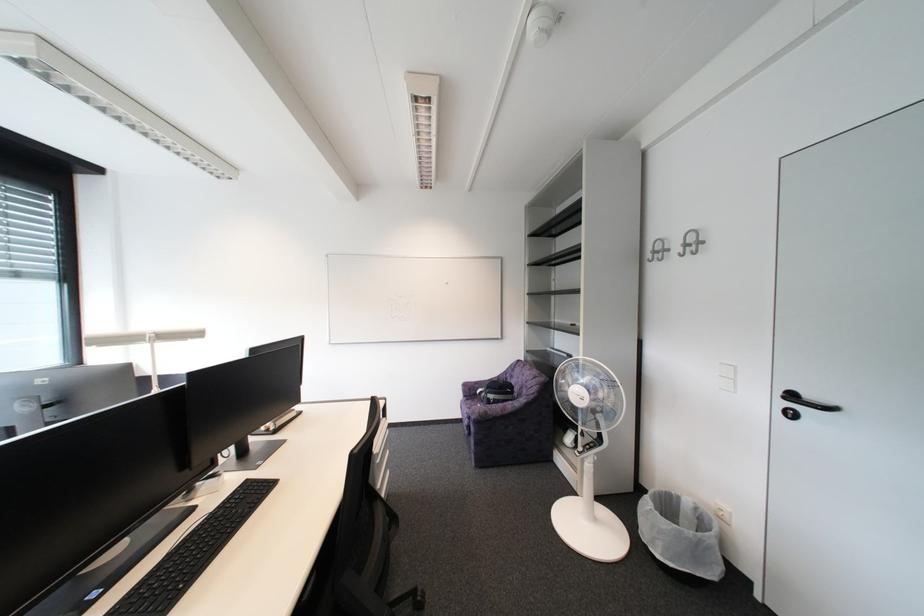
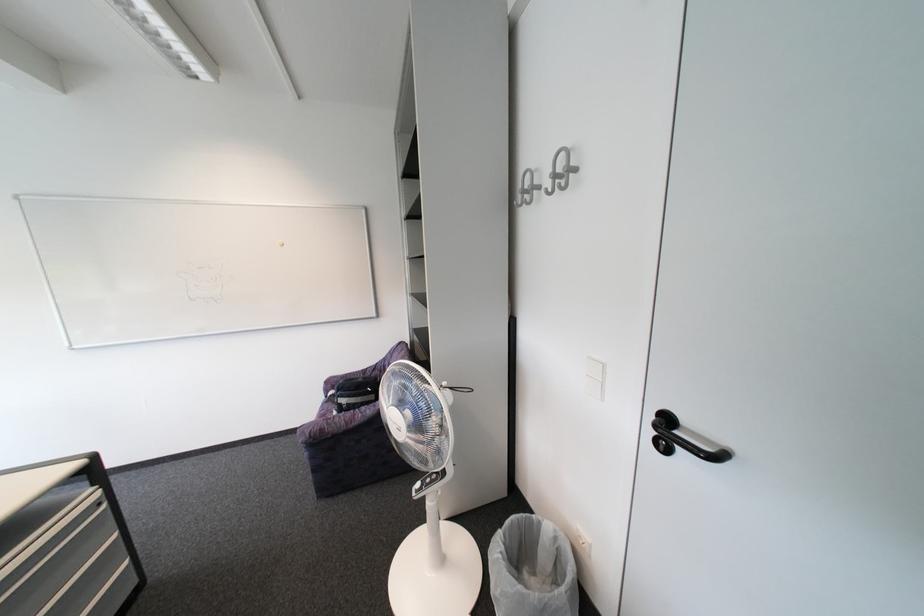
What movement of the cameraman would produce the second image?

The cameraman walked toward right, forward.